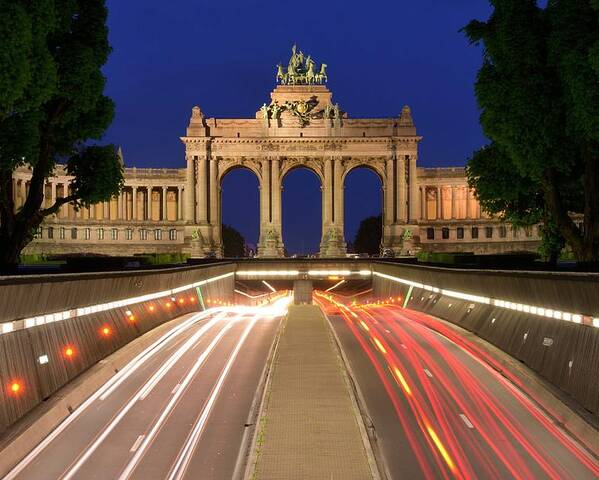
Identify the location of large round pillars. (334, 204), (264, 201), (391, 199), (202, 201).